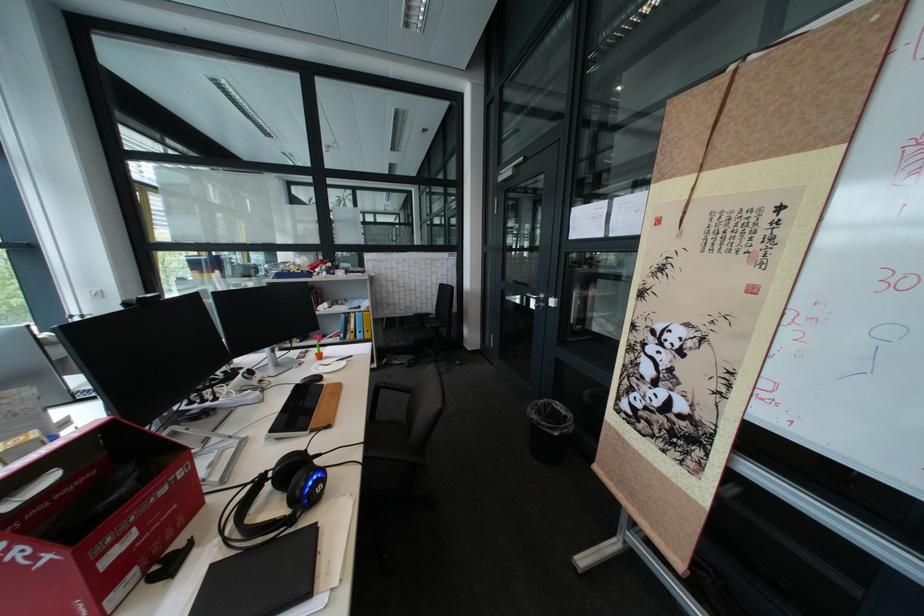
Find where to push the metal door handle. Please return your answer as a coordinate pair (x, y).

(533, 301)